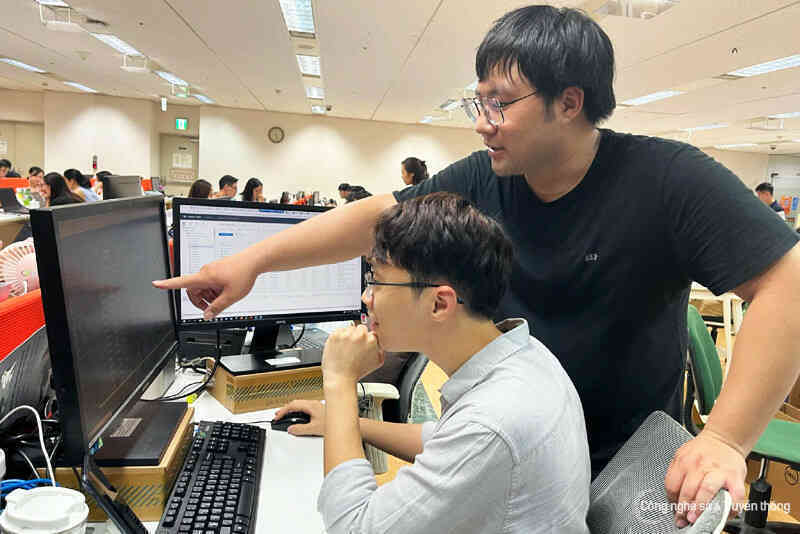
Identify the location of ceiling. This screenshot has width=800, height=534. (374, 18).